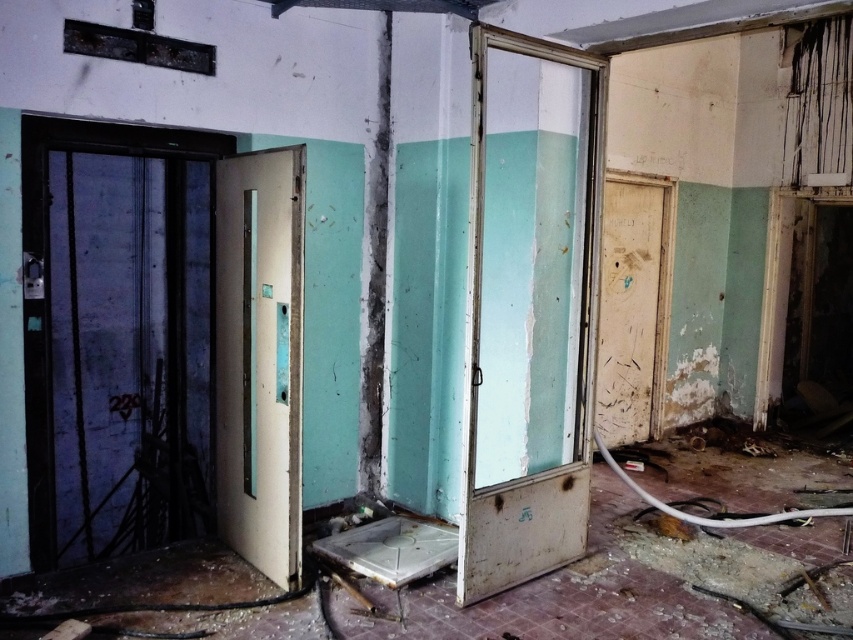
Measure the distance between peeling paint door at center and worn wood door at right.

They are 2.15 meters apart.

Is peeling paint door at center taller than worn wood door at right?

Indeed, peeling paint door at center has a greater height compared to worn wood door at right.

Is point (555, 129) positioned before point (631, 180)?

Yes, point (555, 129) is closer to viewer.

The width and height of the screenshot is (853, 640). What are the coordinates of `peeling paint door at center` in the screenshot? It's located at (531, 307).

Is peeling paint door at center to the left of white matte door at center from the viewer's perspective?

In fact, peeling paint door at center is to the right of white matte door at center.

Who is more distant from viewer, (573,435) or (270,170)?

Positioned behind is point (573,435).

Does point (489, 193) come behind point (277, 358)?

Yes.

Where is `peeling paint door at center`? This screenshot has height=640, width=853. peeling paint door at center is located at coordinates (531, 307).

Is white matte door at center positioned in front of worn wood door at right?

Yes.

How much distance is there between white matte door at center and worn wood door at right?

A distance of 3.09 meters exists between white matte door at center and worn wood door at right.

Between point (224, 492) and point (619, 188), which one is positioned in front?

Point (224, 492) is more forward.

Locate an element on the screen. The width and height of the screenshot is (853, 640). white matte door at center is located at coordinates (259, 358).